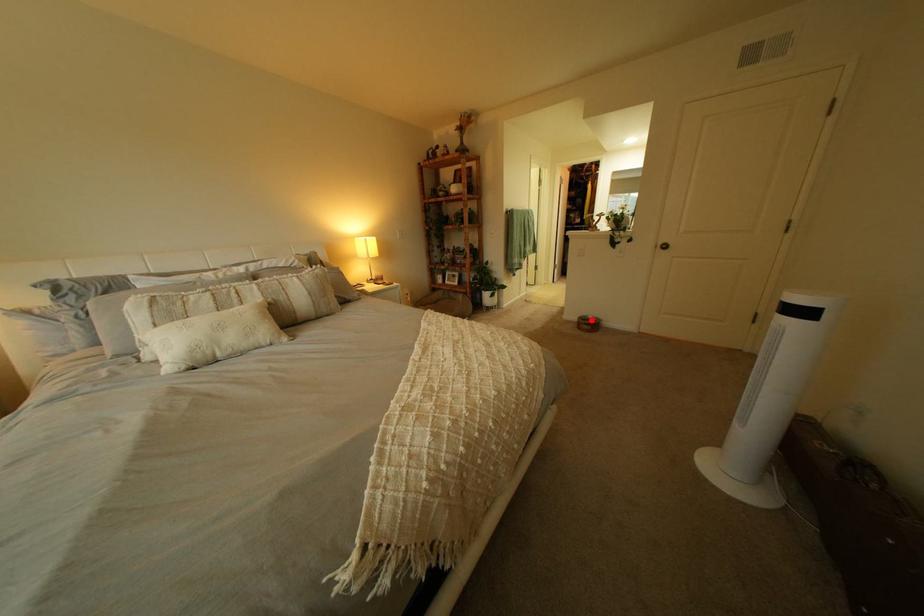
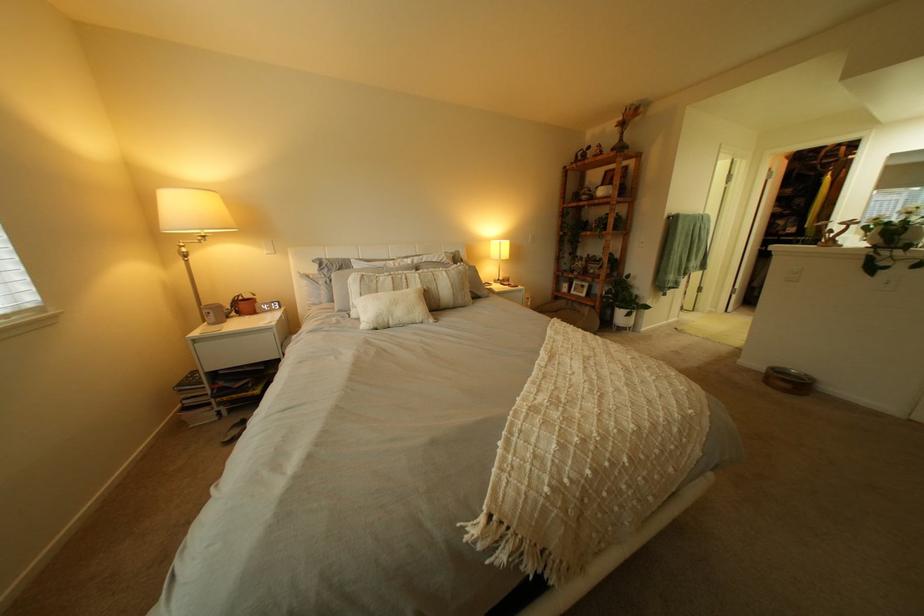
Question: I am providing you with two images of the same scene from different viewpoints. A red point is shown in image1. For the corresponding object point in image2, is it positioned nearer or farther from the camera?

Choices:
 (A) Nearer
 (B) Farther

Answer: (B)